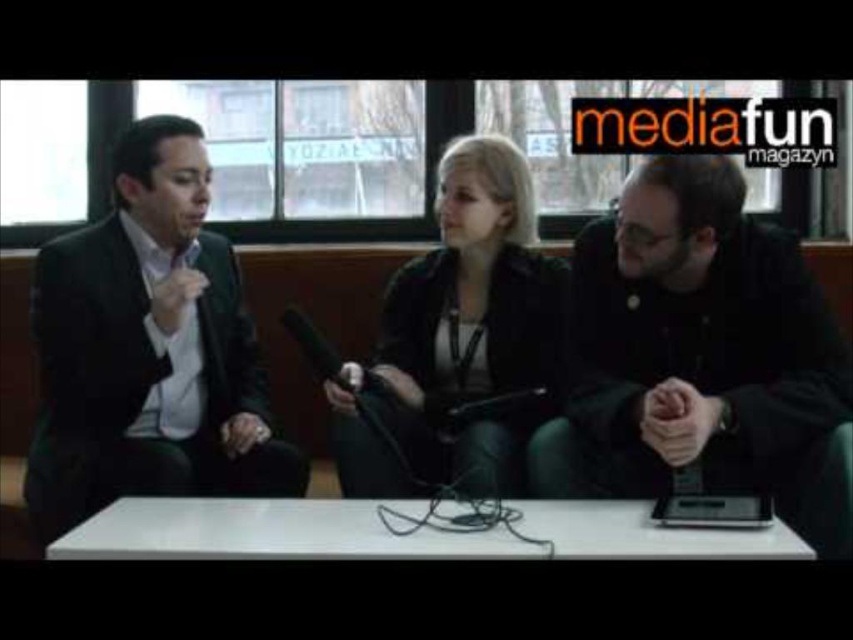
Who is lower down, black matte jacket at right or white glossy table at center?

white glossy table at center

Is point (563, 465) in front of point (592, 541)?

No, it is not.

This screenshot has height=640, width=853. Describe the element at coordinates (689, 344) in the screenshot. I see `black matte jacket at right` at that location.

This screenshot has height=640, width=853. In order to click on black matte jacket at right in this screenshot , I will do `click(689, 344)`.

Consider the image. Is white glossy table at center further to the viewer compared to black suit at left?

That is False.

Who is more forward, (131, 593) or (61, 440)?

Positioned in front is point (131, 593).

Is point (691, 612) more distant than point (115, 440)?

That is False.

What are the coordinates of `white glossy table at center` in the screenshot? It's located at (456, 604).

Is black suit at left thinner than black leather jacket at center?

No.

Who is positioned more to the right, black suit at left or black leather jacket at center?

Positioned to the right is black leather jacket at center.

Is point (93, 356) less distant than point (456, 304)?

Yes, it is.

Find the location of a particular element. black suit at left is located at coordinates (148, 349).